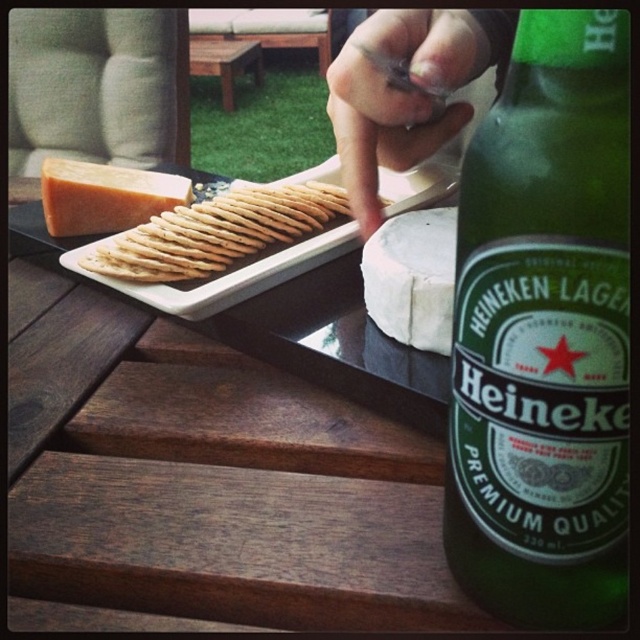
Question: Is green glass bottle at right positioned behind golden crisp crackers at center left?

Choices:
 (A) yes
 (B) no

Answer: (B)

Question: Which point is closer to the camera taking this photo?

Choices:
 (A) (584, 256)
 (B) (164, 380)

Answer: (A)

Question: Is white creamy cheese at center wider than orange hard cheese at upper left?

Choices:
 (A) no
 (B) yes

Answer: (A)

Question: Is smooth skin hand at upper center above golden crisp crackers at center left?

Choices:
 (A) yes
 (B) no

Answer: (A)

Question: Which point is closer to the camera taking this photo?

Choices:
 (A) (548, 72)
 (B) (182, 358)
 (C) (92, 172)

Answer: (A)

Question: Which point is farther to the camera?

Choices:
 (A) wooden table at center
 (B) smooth skin hand at upper center

Answer: (B)